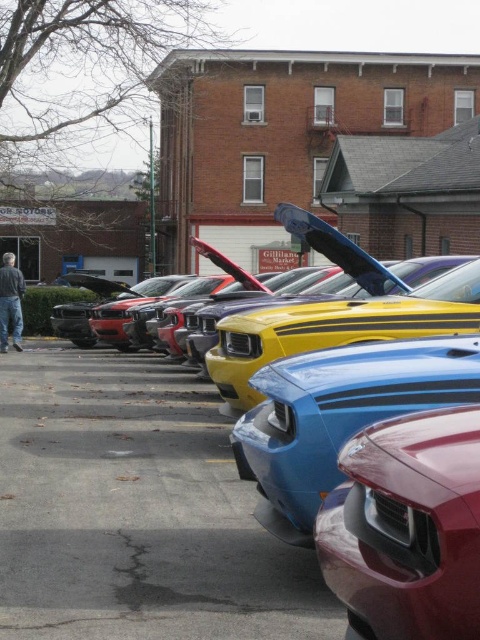
Does blue glossy car at center appear on the left side of glossy red car at center?

Yes, blue glossy car at center is to the left of glossy red car at center.

Does point (101, 360) come in front of point (361, 618)?

No, (101, 360) is further to viewer.

Is point (74, 445) farther from viewer compared to point (450, 461)?

That is True.

Where is `blue glossy car at center`? The image size is (480, 640). blue glossy car at center is located at coordinates (134, 512).

Is point (45, 481) positioned in front of point (109, 593)?

No.

Is yellow glossy car at center in front of blue glossy car at center?

No, it is not.

What do you see at coordinates (134, 509) in the screenshot? Image resolution: width=480 pixels, height=640 pixels. I see `yellow glossy car at center` at bounding box center [134, 509].

This screenshot has width=480, height=640. Find the location of `yellow glossy car at center`. yellow glossy car at center is located at coordinates (134, 509).

This screenshot has width=480, height=640. In order to click on yellow glossy car at center in this screenshot , I will do `click(134, 509)`.

Can you confirm if yellow glossy car at center is shorter than glossy red car at center?

Incorrect, yellow glossy car at center's height does not fall short of glossy red car at center's.

Which is behind, point (116, 557) or point (404, 614)?

Point (116, 557)

This screenshot has width=480, height=640. Find the location of `yellow glossy car at center`. yellow glossy car at center is located at coordinates (134, 509).